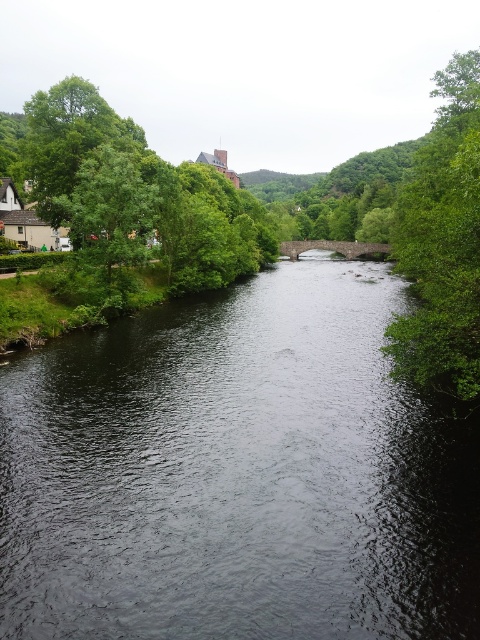
You are standing on the riverbank and see the dark gray water at center and the green leafy tree at right. Which object is closer to you?

The dark gray water at center is closer to you because it is in front of the green leafy tree at right.

You are standing at the point with coordinates point [99,259] and want to see if you can see the point with coordinates point [17,483]. Can you see it?

Point [17,483] is in front of point [99,259], so yes, you can see it from your current position.